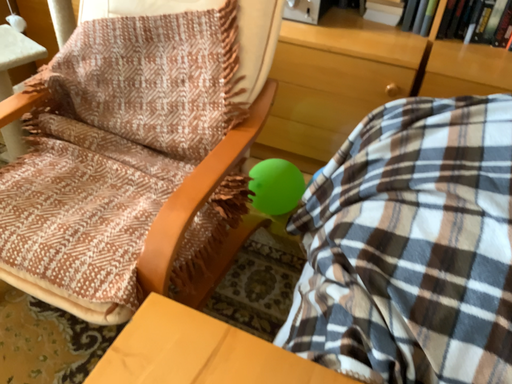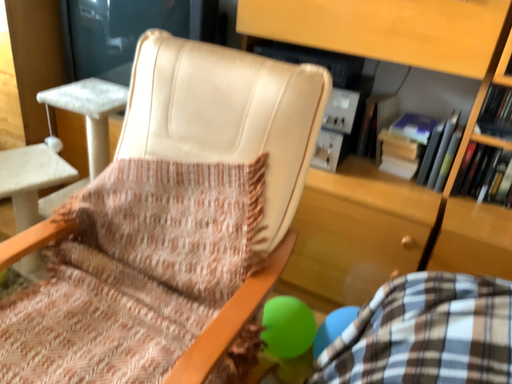
Question: Which way did the camera rotate in the video?

Choices:
 (A) rotated upward
 (B) rotated downward

Answer: (A)